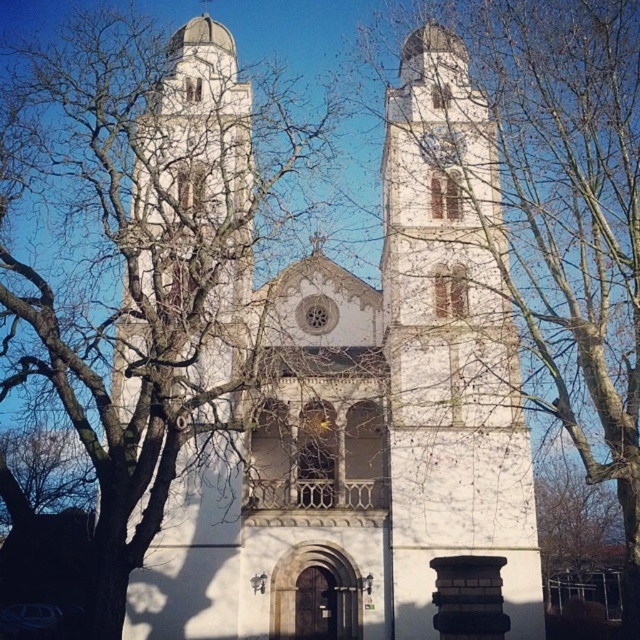
Question: Which of the following is the farthest from the observer?

Choices:
 (A) bare branches at left
 (B) white stone tower at center

Answer: (B)

Question: Observing the image, what is the correct spatial positioning of white stone church at center in reference to bare branches at left?

Choices:
 (A) above
 (B) below

Answer: (A)

Question: Considering the real-world distances, which object is farthest from the bare branches at left?

Choices:
 (A) white stone church at center
 (B) white stone tower at center

Answer: (B)

Question: Which object appears farthest from the camera in this image?

Choices:
 (A) bare branches at left
 (B) white stone church at center
 (C) white stone tower at center

Answer: (B)

Question: From the image, what is the correct spatial relationship of white stone tower at center in relation to bare branches at left?

Choices:
 (A) right
 (B) left

Answer: (A)

Question: Is white stone church at center behind bare branches at left?

Choices:
 (A) no
 (B) yes

Answer: (B)